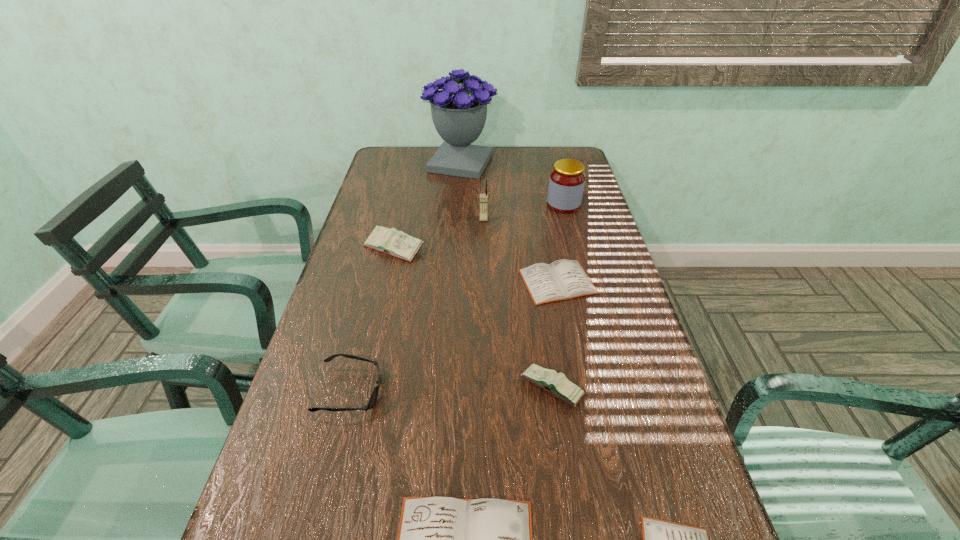
Locate an element on the screen. diary that is at the left edge is located at coordinates click(x=398, y=244).

You are a GUI agent. You are given a task and a screenshot of the screen. Output one action in this format:
    pyautogui.click(x=<x>, y=<y>)
    Task: Click on the sunglasses that is at the left edge
    Image resolution: width=960 pixels, height=540 pixels.
    Given the screenshot: What is the action you would take?
    pyautogui.click(x=374, y=395)

Locate an element on the screen. Image resolution: width=960 pixels, height=540 pixels. jar present at the right edge is located at coordinates (567, 179).

The width and height of the screenshot is (960, 540). Find the location of `diary situated at the right edge`. diary situated at the right edge is located at coordinates [x=563, y=279].

Locate an element on the screen. vacant space at the far edge is located at coordinates (434, 146).

Where is `free space at the left edge of the desktop`? This screenshot has width=960, height=540. free space at the left edge of the desktop is located at coordinates (363, 234).

You are a GUI agent. You are given a task and a screenshot of the screen. Output one action in this format:
    pyautogui.click(x=<x>, y=<y>)
    Task: Click on the free region at the right edge
    Image resolution: width=960 pixels, height=540 pixels.
    Given the screenshot: What is the action you would take?
    pyautogui.click(x=606, y=459)

The image size is (960, 540). In order to click on free area in between the nearer pink diary and the tallest diary in this screenshot , I will do `click(473, 318)`.

At what (x,y) coordinates should I click in order to perform the action: click on free space between the second tallest diary and the cellular telephone. Please return your answer as a coordinate pair (x, y). This screenshot has width=960, height=540. Looking at the image, I should click on (517, 303).

Where is `blank region between the left pink diary and the purple bouquet`? The height and width of the screenshot is (540, 960). blank region between the left pink diary and the purple bouquet is located at coordinates (428, 205).